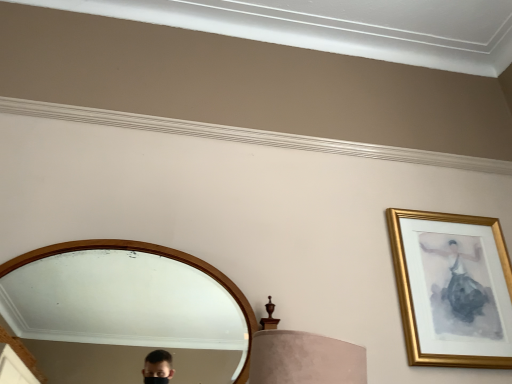
Where is `wooden mirror at center`? This screenshot has width=512, height=384. wooden mirror at center is located at coordinates (124, 304).

The width and height of the screenshot is (512, 384). Describe the element at coordinates (124, 304) in the screenshot. I see `wooden mirror at center` at that location.

Measure the distance between wooden mirror at center and camera.

The distance of wooden mirror at center from camera is 9.06 feet.

What do you see at coordinates (452, 288) in the screenshot?
I see `gold framed picture at upper right` at bounding box center [452, 288].

Locate an element on the screen. gold framed picture at upper right is located at coordinates (452, 288).

The height and width of the screenshot is (384, 512). I want to click on wooden mirror at center, so click(124, 304).

Which object is positioned more to the right, gold framed picture at upper right or wooden mirror at center?

gold framed picture at upper right.

Which object is more forward, gold framed picture at upper right or wooden mirror at center?

wooden mirror at center is more forward.

Which is behind, point (445, 233) or point (205, 345)?

The point (445, 233) is behind.

From the image's perspective, which one is positioned higher, gold framed picture at upper right or wooden mirror at center?

gold framed picture at upper right appears higher in the image.

From a real-world perspective, which object rests below the other?

wooden mirror at center is physically lower.

Looking at their sizes, would you say gold framed picture at upper right is wider or thinner than wooden mirror at center?

gold framed picture at upper right is thinner than wooden mirror at center.

Does gold framed picture at upper right have a greater height compared to wooden mirror at center?

Yes.

Considering the sizes of gold framed picture at upper right and wooden mirror at center in the image, is gold framed picture at upper right bigger or smaller than wooden mirror at center?

Clearly, gold framed picture at upper right is smaller in size than wooden mirror at center.

Do you think gold framed picture at upper right is within wooden mirror at center, or outside of it?

gold framed picture at upper right is located beyond the bounds of wooden mirror at center.

Is gold framed picture at upper right not near wooden mirror at center?

Yes, gold framed picture at upper right is far from wooden mirror at center.

Is gold framed picture at upper right positioned with its back to wooden mirror at center?

No, gold framed picture at upper right is not facing away from wooden mirror at center.

What's the angular difference between gold framed picture at upper right and wooden mirror at center's facing directions?

The angle between the facing direction of gold framed picture at upper right and the facing direction of wooden mirror at center is 1.48e-06 degrees.

Image resolution: width=512 pixels, height=384 pixels. What are the coordinates of `picture frame that appears above the wooden mirror at center (from a real-world perspective)` in the screenshot? It's located at (452, 288).

Considering the positions of objects wooden mirror at center and gold framed picture at upper right in the image provided, who is more to the left, wooden mirror at center or gold framed picture at upper right?

Positioned to the left is wooden mirror at center.

Is wooden mirror at center in front of gold framed picture at upper right?

Yes, the depth of wooden mirror at center is less than that of gold framed picture at upper right.

Is point (98, 278) farther from viewer compared to point (485, 267)?

Yes, it is behind point (485, 267).

From the image's perspective, would you say wooden mirror at center is shown under gold framed picture at upper right?

Correct, wooden mirror at center appears lower than gold framed picture at upper right in the image.

From a real-world perspective, is wooden mirror at center on gold framed picture at upper right?

Actually, wooden mirror at center is physically below gold framed picture at upper right in the real world.

Between wooden mirror at center and gold framed picture at upper right, which one has larger width?

With larger width is wooden mirror at center.

Considering the sizes of objects wooden mirror at center and gold framed picture at upper right in the image provided, who is shorter, wooden mirror at center or gold framed picture at upper right?

wooden mirror at center.

Does wooden mirror at center have a larger size compared to gold framed picture at upper right?

Yes, wooden mirror at center is bigger than gold framed picture at upper right.

Is gold framed picture at upper right a part of wooden mirror at center?

That's incorrect, gold framed picture at upper right is not inside wooden mirror at center.

Is wooden mirror at center not near gold framed picture at upper right?

Yes, wooden mirror at center is far from gold framed picture at upper right.

Is gold framed picture at upper right at the back of wooden mirror at center?

That's not correct — wooden mirror at center is not looking away from gold framed picture at upper right.

How many degrees apart are the facing directions of wooden mirror at center and gold framed picture at upper right?

There is a 1.48e-06-degree angle between the facing directions of wooden mirror at center and gold framed picture at upper right.

Find the location of a particular element. mirror located on the left of gold framed picture at upper right is located at coordinates (124, 304).

Identify the location of mirror on the left of gold framed picture at upper right. click(x=124, y=304).

I want to click on picture frame to the right of wooden mirror at center, so click(x=452, y=288).